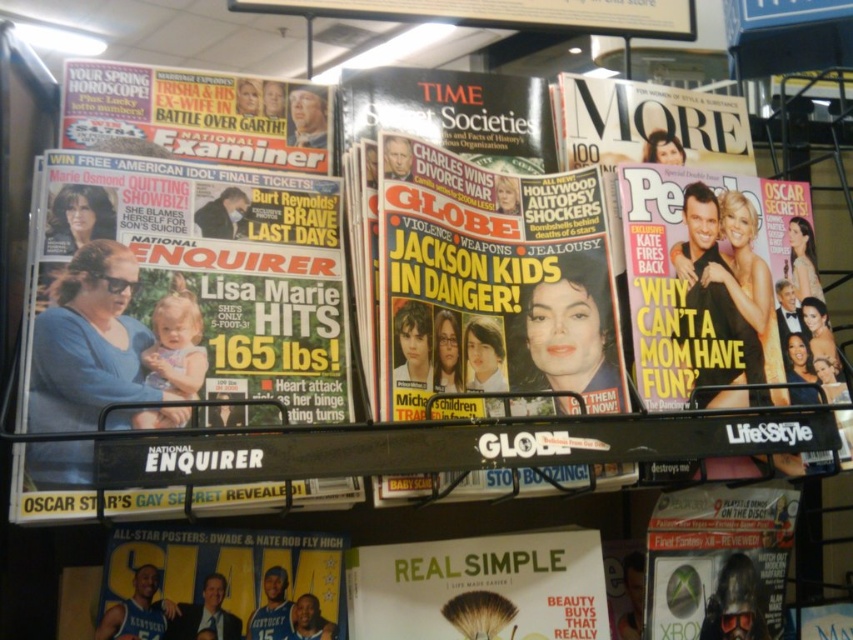
Who is shorter, blue fabric poster at lower center or matte white magazine at center?

matte white magazine at center

Image resolution: width=853 pixels, height=640 pixels. I want to click on blue fabric poster at lower center, so click(x=221, y=584).